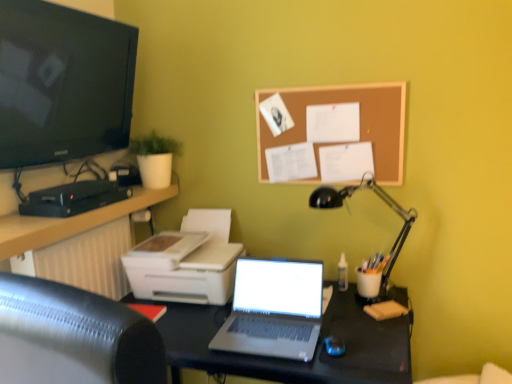
Locate an element on the screen. The height and width of the screenshot is (384, 512). white plastic printer at lower left is located at coordinates (191, 265).

Find the location of a particular element. This screenshot has height=384, width=512. silver metallic laptop at center is located at coordinates (274, 309).

This screenshot has width=512, height=384. Find the location of `black plastic shelf at upper left`. black plastic shelf at upper left is located at coordinates (78, 243).

Identify the location of black metal desk lamp at right. The width and height of the screenshot is (512, 384). (376, 194).

Describe the element at coordinates (360, 122) in the screenshot. I see `corkboard at upper center` at that location.

Where is `white plastic printer at lower left`? white plastic printer at lower left is located at coordinates (191, 265).

Does corkboard at upper center come behind matte black entertainment center at left?

That is True.

Locate an element on the screen. entertainment center in front of the corkboard at upper center is located at coordinates (292, 360).

Is corkboard at upper center at the right side of matte black entertainment center at left?

Indeed, corkboard at upper center is positioned on the right side of matte black entertainment center at left.

In the scene shown: Is corkboard at upper center taller than matte black entertainment center at left?

No, corkboard at upper center is not taller than matte black entertainment center at left.

Considering their positions, is black plastic shelf at upper left located in front of or behind corkboard at upper center?

Clearly, black plastic shelf at upper left is in front of corkboard at upper center.

In the scene shown: Are black plastic shelf at upper left and corkboard at upper center located far from each other?

No, black plastic shelf at upper left is not far away from corkboard at upper center.

From the image's perspective, relative to corkboard at upper center, is black plastic shelf at upper left above or below?

Clearly, from the image's perspective, black plastic shelf at upper left is below corkboard at upper center.

Between black plastic shelf at upper left and corkboard at upper center, which one has smaller width?

corkboard at upper center is thinner.

Is corkboard at upper center completely or partially outside of metallic gray laptop at center?

corkboard at upper center is positioned outside metallic gray laptop at center.

What's the angular difference between corkboard at upper center and metallic gray laptop at center's facing directions?

1.5 degrees separate the facing orientations of corkboard at upper center and metallic gray laptop at center.

Looking at their sizes, would you say corkboard at upper center is wider or thinner than metallic gray laptop at center?

In the image, corkboard at upper center appears to be more narrow than metallic gray laptop at center.

Is corkboard at upper center next to metallic gray laptop at center and touching it?

corkboard at upper center is not next to metallic gray laptop at center, and they're not touching.

Considering the relative positions of metallic gray laptop at center and white plastic printer at lower left in the image provided, is metallic gray laptop at center to the left or to the right of white plastic printer at lower left?

metallic gray laptop at center is positioned on white plastic printer at lower left's right side.

Are metallic gray laptop at center and white plastic printer at lower left making contact?

They are not placed beside each other.

Is point (309, 370) positioned behind point (154, 288)?

No, it is not.

Which object is closer to the camera taking this photo, white plastic printer at lower left or matte black entertainment center at left?

Positioned in front is matte black entertainment center at left.

Are white plastic printer at lower left and matte black entertainment center at left far apart?

white plastic printer at lower left is actually quite close to matte black entertainment center at left.

At what (x,y) coordinates should I click in order to perform the action: click on entertainment center in front of the white plastic printer at lower left. Please return your answer as a coordinate pair (x, y). This screenshot has height=384, width=512. Looking at the image, I should click on (292, 360).

Does white plastic printer at lower left touch black metal desk lamp at right?

white plastic printer at lower left and black metal desk lamp at right are clearly separated.

Locate an element on the screen. The image size is (512, 384). printer below the black metal desk lamp at right (from a real-world perspective) is located at coordinates (191, 265).

Can you confirm if white plastic printer at lower left is bigger than black metal desk lamp at right?

Correct, white plastic printer at lower left is larger in size than black metal desk lamp at right.

Between black metal desk lamp at right and corkboard at upper center, which one has larger width?

Wider between the two is black metal desk lamp at right.

From a real-world perspective, does black metal desk lamp at right stand above corkboard at upper center?

No, from a real-world perspective, black metal desk lamp at right is not over corkboard at upper center

Which point is more forward, (386, 194) or (376, 173)?

The point (376, 173) is in front.

I want to click on lamp below the corkboard at upper center (from a real-world perspective), so click(376, 194).

What are the coordinates of `entertainment center below the corkboard at upper center (from a real-world perspective)` in the screenshot? It's located at (292, 360).

At what (x,y) coordinates should I click in order to perform the action: click on computer desk in front of the corkboard at upper center. Please return your answer as a coordinate pair (x, y). This screenshot has height=384, width=512. Looking at the image, I should click on (78, 243).

Estimate the real-world distances between objects in this image. Which object is closer to metallic gray laptop at center, corkboard at upper center or black metal desk lamp at right?

black metal desk lamp at right is positioned closer to the anchor metallic gray laptop at center.

From the image, which object appears to be farther from black plastic shelf at upper left, silver metallic laptop at center or black glossy screen at upper left?

Among the two, silver metallic laptop at center is located further to black plastic shelf at upper left.

Which object lies nearer to the anchor point black metal desk lamp at right, silver metallic laptop at center or metallic gray laptop at center?

metallic gray laptop at center is closer to black metal desk lamp at right.

Looking at the image, which one is located closer to black plastic shelf at upper left, metallic gray laptop at center or black glossy screen at upper left?

black glossy screen at upper left.

Which object lies further to the anchor point silver metallic laptop at center, corkboard at upper center or metallic gray laptop at center?

Among the two, corkboard at upper center is located further to silver metallic laptop at center.

Looking at the image, which one is located further to metallic gray laptop at center, corkboard at upper center or matte black entertainment center at left?

The object further to metallic gray laptop at center is corkboard at upper center.

Based on their spatial positions, is white plastic printer at lower left or corkboard at upper center further from black plastic shelf at upper left?

corkboard at upper center is further to black plastic shelf at upper left.

When comparing their distances from metallic gray laptop at center, does corkboard at upper center or black plastic shelf at upper left seem further?

The object further to metallic gray laptop at center is corkboard at upper center.

Locate an element on the screen. Image resolution: width=512 pixels, height=384 pixels. laptop between black plastic shelf at upper left and corkboard at upper center from left to right is located at coordinates (274, 309).

Locate an element on the screen. The image size is (512, 384). computer desk that lies between black glossy screen at upper left and white plastic printer at lower left from top to bottom is located at coordinates (78, 243).

Where is `entertainment center located between black glossy screen at upper left and black metal desk lamp at right in the left-right direction`? The width and height of the screenshot is (512, 384). entertainment center located between black glossy screen at upper left and black metal desk lamp at right in the left-right direction is located at coordinates (292, 360).

Locate an element on the screen. This screenshot has height=384, width=512. laptop between matte black entertainment center at left and white plastic printer at lower left along the z-axis is located at coordinates (274, 309).